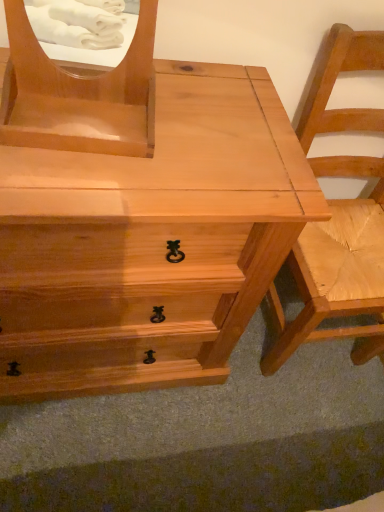
Question: Does natural wood chest of drawers at center have a larger size compared to natural wood chair at right?

Choices:
 (A) yes
 (B) no

Answer: (A)

Question: Does natural wood chest of drawers at center turn towards natural wood chair at right?

Choices:
 (A) yes
 (B) no

Answer: (B)

Question: Is natural wood chest of drawers at center oriented away from natural wood chair at right?

Choices:
 (A) no
 (B) yes

Answer: (A)

Question: Is natural wood chest of drawers at center at the left side of natural wood chair at right?

Choices:
 (A) yes
 (B) no

Answer: (A)

Question: From a real-world perspective, is natural wood chest of drawers at center positioned over natural wood chair at right based on gravity?

Choices:
 (A) yes
 (B) no

Answer: (B)

Question: From the image's perspective, is matte wood mirror at upper left above or below natural wood chest of drawers at center?

Choices:
 (A) below
 (B) above

Answer: (B)

Question: Considering the positions of point (16, 11) and point (6, 346), is point (16, 11) closer or farther from the camera than point (6, 346)?

Choices:
 (A) closer
 (B) farther

Answer: (A)

Question: Which is correct: matte wood mirror at upper left is inside natural wood chest of drawers at center, or outside of it?

Choices:
 (A) inside
 (B) outside

Answer: (B)

Question: From a real-world perspective, is matte wood mirror at upper left above or below natural wood chest of drawers at center?

Choices:
 (A) below
 (B) above

Answer: (B)

Question: In the image, is matte wood mirror at upper left on the left side or the right side of natural wood chair at right?

Choices:
 (A) left
 (B) right

Answer: (A)

Question: Considering the positions of matte wood mirror at upper left and natural wood chair at right in the image, is matte wood mirror at upper left taller or shorter than natural wood chair at right?

Choices:
 (A) short
 (B) tall

Answer: (A)

Question: Considering the positions of matte wood mirror at upper left and natural wood chair at right in the image, is matte wood mirror at upper left bigger or smaller than natural wood chair at right?

Choices:
 (A) small
 (B) big

Answer: (A)

Question: Is matte wood mirror at upper left inside or outside of natural wood chair at right?

Choices:
 (A) inside
 (B) outside

Answer: (B)

Question: Considering the positions of natural wood chair at right and natural wood chest of drawers at center in the image, is natural wood chair at right wider or thinner than natural wood chest of drawers at center?

Choices:
 (A) thin
 (B) wide

Answer: (A)

Question: Considering the positions of point (344, 272) and point (139, 269), is point (344, 272) closer or farther from the camera than point (139, 269)?

Choices:
 (A) farther
 (B) closer

Answer: (A)